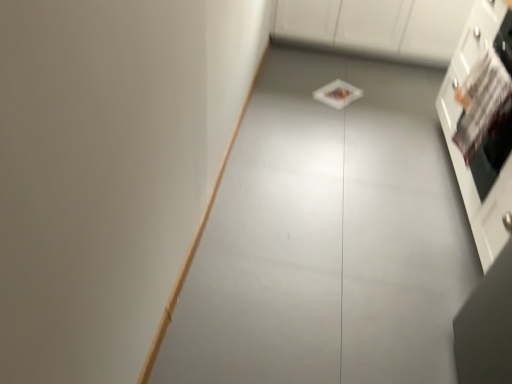
Question: From a real-world perspective, is white glossy cabinet at right, marked as the 1th cabinetry in a front-to-back arrangement, physically located above or below white glossy cabinet at upper center, the second cabinetry from the bottom?

Choices:
 (A) above
 (B) below

Answer: (A)

Question: Considering their positions, is white glossy cabinet at right, which is the 1th cabinetry from bottom to top, located in front of or behind white glossy cabinet at upper center, which is counted as the first cabinetry, starting from the back?

Choices:
 (A) behind
 (B) front

Answer: (B)

Question: Is white glossy cabinet at right, marked as the 1th cabinetry in a front-to-back arrangement, situated inside white glossy cabinet at upper center, which is counted as the first cabinetry, starting from the back, or outside?

Choices:
 (A) inside
 (B) outside

Answer: (B)

Question: From their relative heights in the image, would you say white glossy cabinet at upper center, arranged as the second cabinetry when viewed from the front, is taller or shorter than white glossy cabinet at right, which is the 1th cabinetry from bottom to top?

Choices:
 (A) tall
 (B) short

Answer: (B)

Question: In terms of width, does white glossy cabinet at upper center, which is counted as the first cabinetry, starting from the back, look wider or thinner when compared to white glossy cabinet at right, marked as the 1th cabinetry in a front-to-back arrangement?

Choices:
 (A) thin
 (B) wide

Answer: (B)

Question: In terms of size, does white glossy cabinet at upper center, which is counted as the first cabinetry, starting from the back, appear bigger or smaller than white glossy cabinet at right, the second cabinetry from the top?

Choices:
 (A) big
 (B) small

Answer: (B)

Question: Is white glossy cabinet at upper center, which is the first cabinetry from top to bottom, in front of or behind white glossy cabinet at right, which is the 1th cabinetry from bottom to top, in the image?

Choices:
 (A) behind
 (B) front

Answer: (A)